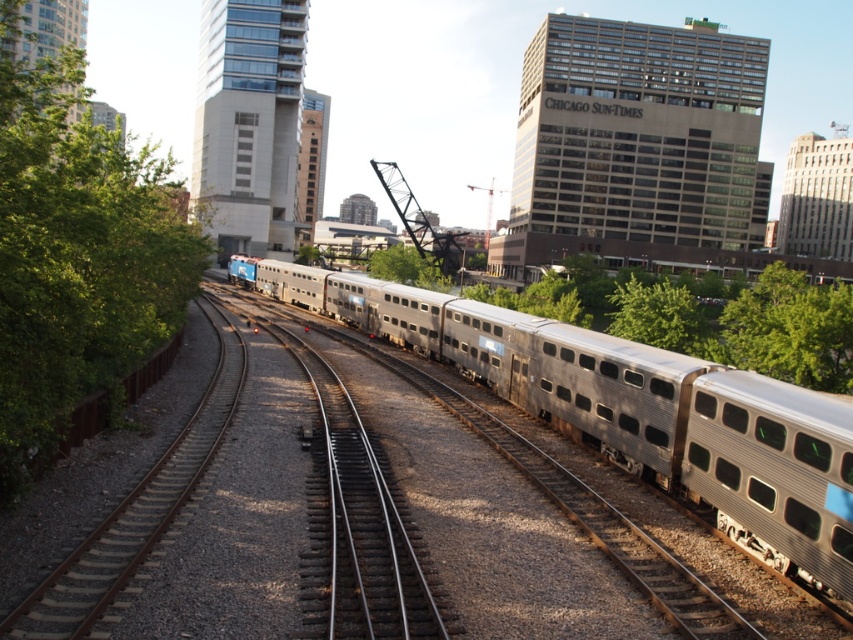
In the scene shown: You are a pedestrian standing at the green leafy tree at left and want to cross the train tracks to reach the silver metallic train at center. The safe distance required to cross is 20 meters. Can you safely cross the tracks to the train?

The silver metallic train at center is 18.08 meters from the green leafy tree at left. Since the required safe distance is 20 meters, the distance is insufficient. You should wait for the train to stop completely before attempting to cross.

You are a pedestrian standing on the sidewalk next to the silver metallic train at center. You want to walk to the green leafy tree at left. Which direction should you turn to reach it?

The green leafy tree at left is located to the left of the silver metallic train at center, so you should turn left to reach it.

You are a photographer planning to take a wide shot of the silver metallic train at center and the green leafy tree at center from a distance. Based on their sizes, which object will appear bigger in the photo?

The silver metallic train at center will appear bigger in the photo because it has a larger size compared to the green leafy tree at center.